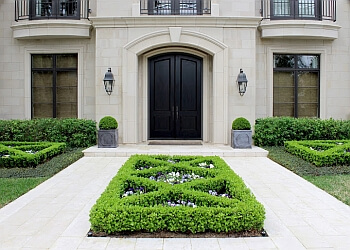
Where is `lamp to the right of the door`? lamp to the right of the door is located at coordinates (241, 75).